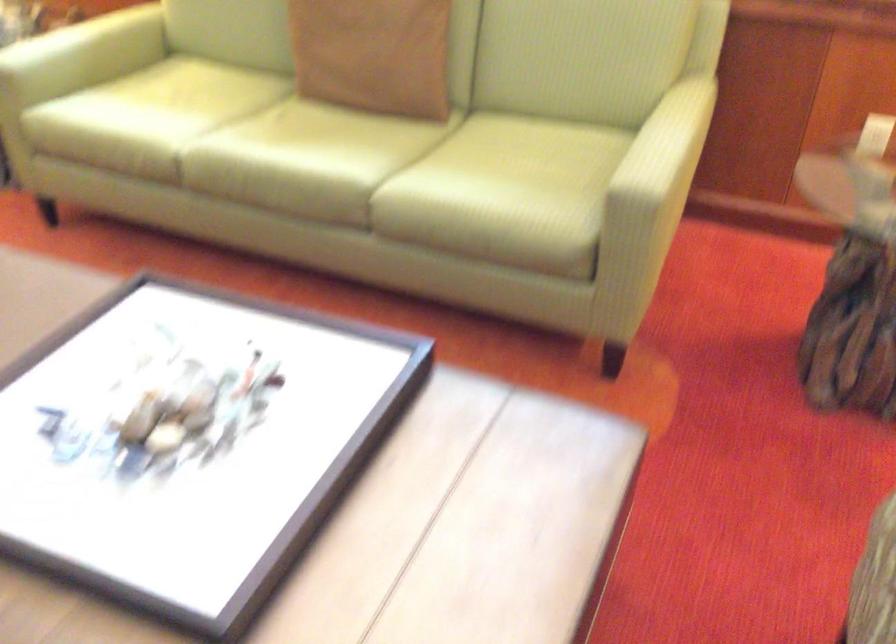
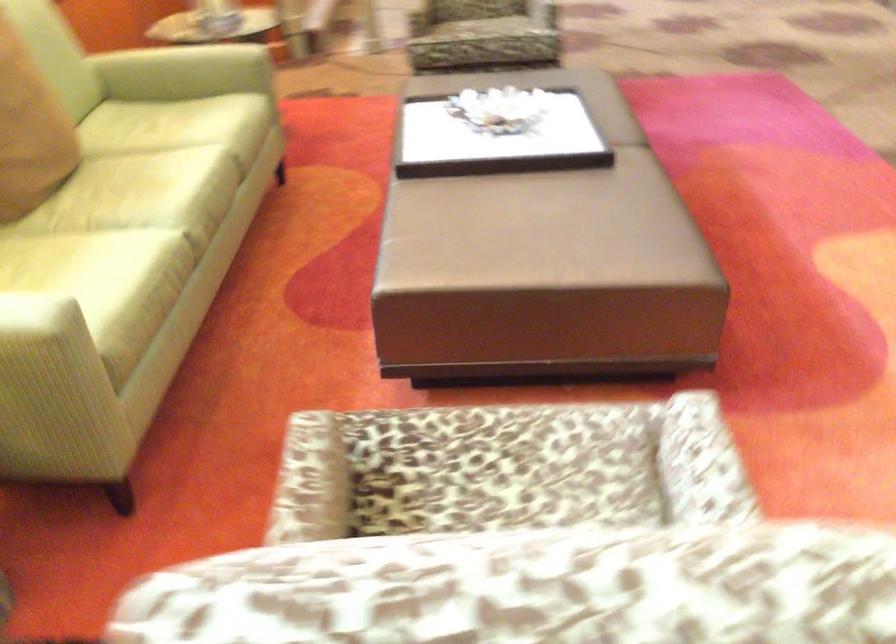
The point at [256,128] is marked in the first image. Where is the corresponding point in the second image?

(136, 199)